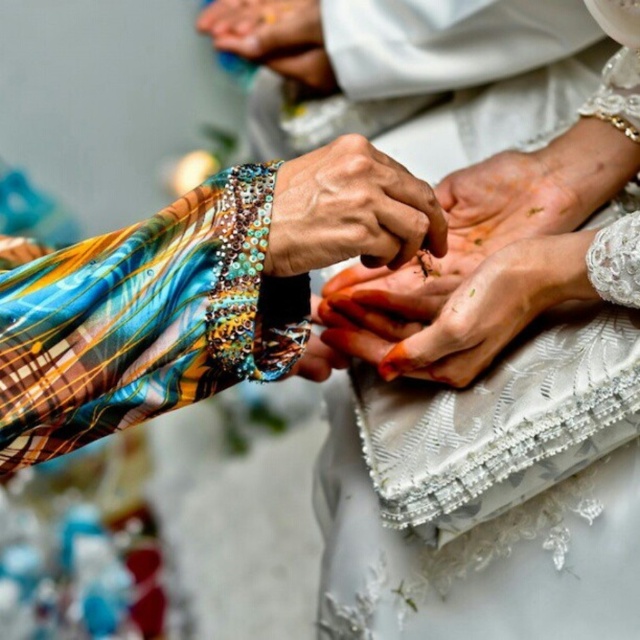
Consider the image. You are a dermatologist examining the hands in the image. You notice the multicolored beaded bracelet at center and the dry skin at center. Which object is shorter in height?

The multicolored beaded bracelet at center has a lesser height compared to dry skin at center, so the multicolored beaded bracelet at center is shorter in height.

Looking at the two hands holding each other in the image, you notice the multicolored beaded bracelet at center and the dry skin at center. Which object is located closer to the viewer?

The multicolored beaded bracelet at center is positioned over dry skin at center, so it is closer to the viewer.

You are an artist sketching the hands in the image. You need to draw the hand at point (292,163) and the hand at point (234,22). Which hand should you draw first to create a sense of depth?

You should draw the hand at point (292,163) first because it is in front of the hand at point (234,22), so drawing it on top will create the correct sense of depth.